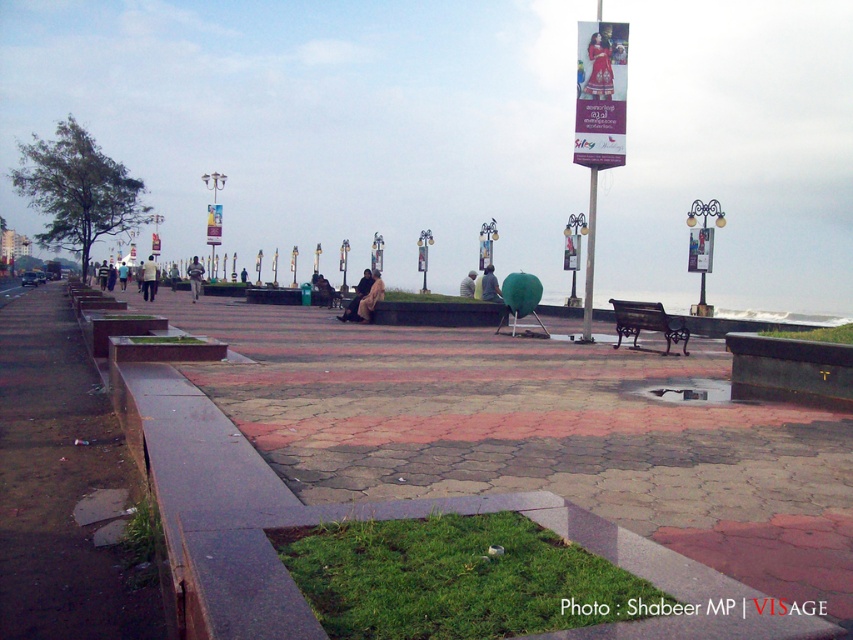
Question: Does dark gray fabric jacket at center have a lesser width compared to light yellow shirt at left?

Choices:
 (A) yes
 (B) no

Answer: (A)

Question: Based on their relative distances, which object is farther from the dark blue fabric jacket at center?

Choices:
 (A) striped fabric person at center
 (B) light brown fabric at center
 (C) dark brown leather jacket at center

Answer: (B)

Question: Does light brown fabric at center have a lesser width compared to striped fabric person at center?

Choices:
 (A) yes
 (B) no

Answer: (A)

Question: Which of the following is the farthest from the observer?

Choices:
 (A) (375, 292)
 (B) (492, 300)
 (C) (469, 269)

Answer: (C)

Question: Does metallic brown bench at lower right have a larger size compared to light yellow shirt at left?

Choices:
 (A) no
 (B) yes

Answer: (A)

Question: Which of the following is the farthest from the observer?

Choices:
 (A) (122, 268)
 (B) (358, 316)

Answer: (A)